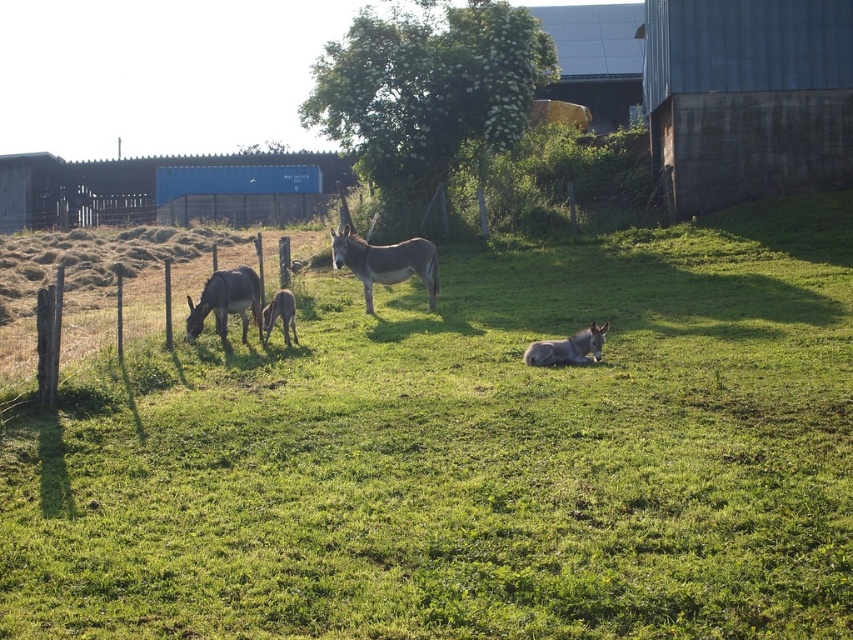
You are a photographer trying to capture the gray matte mule at lower left in the foreground while keeping the green grassy at center visible in the background. Based on their heights, will the mule block the view of the grass in this composition?

The green grassy at center has a greater height compared to the gray matte mule at lower left. Since the grass is taller, the mule at lower left won t completely block the view of the grassy area in the background.

You are a photographer planning to take a portrait of the gray matte mule at center. You want the green grassy at center to be visible in the background but not block the mule. Given their height difference, is this possible?

The green grassy at center is much taller than the gray matte mule at center, so if you position the camera lower to the ground, the grass might obscure the mule. To ensure the mule is visible and the grass is in the background, you might need to angle the camera slightly upward or ensure the mule is positioned higher relative to the grass.

You are a photographer standing at the edge of the field. You want to capture a photo that includes both the green grassy at center and the gray matte mule at lower left. Based on their positions, which object should appear to the right side in your photo?

The green grassy at center appears to the right of the gray matte mule at lower left in the photo.